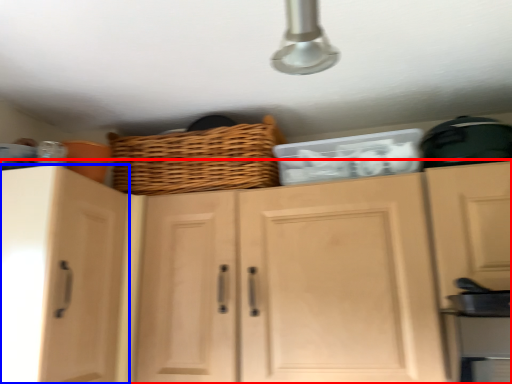
Question: Among these objects, which one is nearest to the camera, cabinetry (highlighted by a red box) or cabinetry (highlighted by a blue box)?

Choices:
 (A) cabinetry
 (B) cabinetry

Answer: (A)